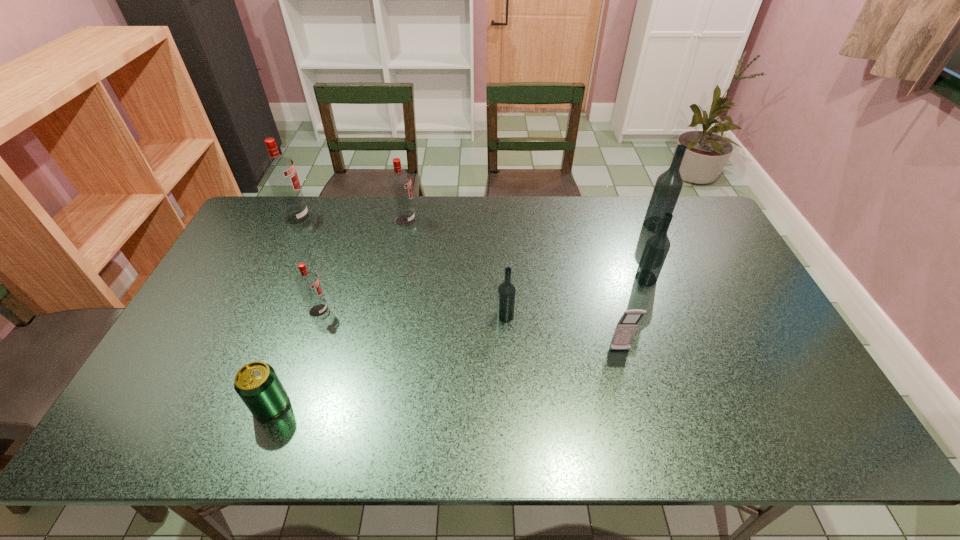
I want to click on unoccupied position between the second smallest red vodka and the second red vodka from left to right, so click(x=362, y=266).

This screenshot has height=540, width=960. Identify the location of free space that is in between the leftmost vodka and the nearest red vodka. click(308, 265).

Identify the location of vacant area between the rightmost vodka and the beer can. The height and width of the screenshot is (540, 960). (463, 315).

Image resolution: width=960 pixels, height=540 pixels. Find the location of `free space between the biggest black vodka and the gray cellular telephone`. free space between the biggest black vodka and the gray cellular telephone is located at coordinates click(x=637, y=288).

Find the location of a particular element. The width and height of the screenshot is (960, 540). the second closest object relative to the beer can is located at coordinates (506, 297).

Select which object appears as the fourth closest to the second nearest black vodka. Please provide its 2D coordinates. Your answer should be formatted as a tuple, i.e. [(x, y)], where the tuple contains the x and y coordinates of a point satisfying the conditions above.

[(399, 182)]

The width and height of the screenshot is (960, 540). Identify the location of the third closest vodka to the leftmost red vodka. (506, 297).

Locate which vodka ranks fourth in proximity to the shortest object. Please provide its 2D coordinates. Your answer should be formatted as a tuple, i.e. [(x, y)], where the tuple contains the x and y coordinates of a point satisfying the conditions above.

[(399, 182)]

Locate which red vodka is the closest to the nearest red vodka. Please provide its 2D coordinates. Your answer should be formatted as a tuple, i.e. [(x, y)], where the tuple contains the x and y coordinates of a point satisfying the conditions above.

[(280, 171)]

Locate an element on the screen. The image size is (960, 540). red vodka that stands as the closest to the rightmost black vodka is located at coordinates (399, 182).